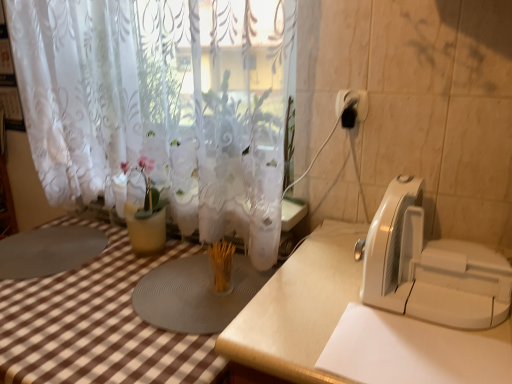
Question: In the image, is white lace curtain at upper center positioned in front of or behind black plastic electric outlet at upper right?

Choices:
 (A) behind
 (B) front

Answer: (B)

Question: In the image, is white lace curtain at upper center on the left side or the right side of black plastic electric outlet at upper right?

Choices:
 (A) right
 (B) left

Answer: (B)

Question: Considering the real-world distances, which object is closest to the white plastic appliance at right?

Choices:
 (A) black plastic electric outlet at upper right
 (B) white lace curtain at upper center
 (C) white matte table at center

Answer: (C)

Question: Which object is positioned farthest from the white lace curtain at upper center?

Choices:
 (A) black plastic electric outlet at upper right
 (B) white plastic appliance at right
 (C) white matte table at center

Answer: (B)